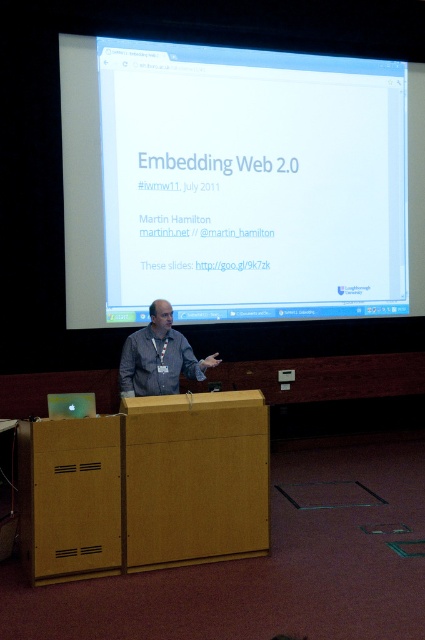
Question: Which point is closer to the camera?

Choices:
 (A) white glossy projector screen at upper center
 (B) gray fabric shirt at center

Answer: (B)

Question: Can you confirm if white glossy projector screen at upper center is positioned above gray fabric shirt at center?

Choices:
 (A) yes
 (B) no

Answer: (A)

Question: In this image, where is white glossy projector screen at upper center located relative to gray fabric shirt at center?

Choices:
 (A) right
 (B) left

Answer: (A)

Question: Is white glossy projector screen at upper center above gray fabric shirt at center?

Choices:
 (A) no
 (B) yes

Answer: (B)

Question: Which object is farther from the camera taking this photo?

Choices:
 (A) gray fabric shirt at center
 (B) white glossy projector screen at upper center

Answer: (B)

Question: Which point is farther from the camera taking this photo?

Choices:
 (A) (133, 385)
 (B) (340, 115)

Answer: (B)